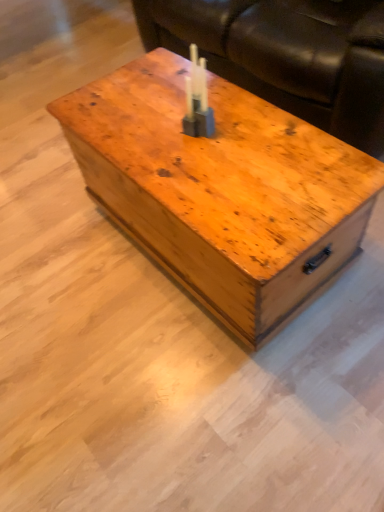
Question: From the image's perspective, is wooden chest at center above or below translucent plastic candle at center?

Choices:
 (A) below
 (B) above

Answer: (A)

Question: Considering the relative positions of wooden chest at center and translucent plastic candle at center in the image provided, is wooden chest at center to the left or to the right of translucent plastic candle at center?

Choices:
 (A) right
 (B) left

Answer: (A)

Question: Which is nearer to the translucent plastic candle at center?

Choices:
 (A) wooden chest at center
 (B) brown leather couch at upper center

Answer: (A)

Question: Based on their relative distances, which object is nearer to the wooden chest at center?

Choices:
 (A) translucent plastic candle at center
 (B) brown leather couch at upper center

Answer: (A)